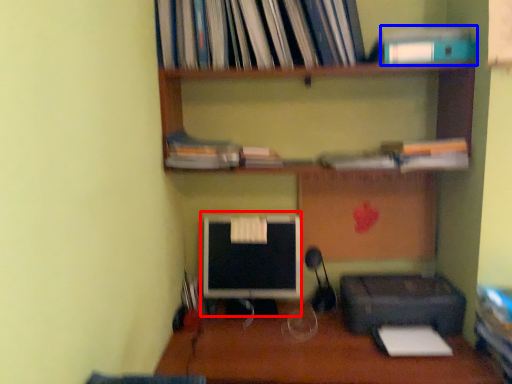
Question: Which object appears closest to the camera in this image, computer monitor (highlighted by a red box) or paperback book (highlighted by a blue box)?

Choices:
 (A) computer monitor
 (B) paperback book

Answer: (B)